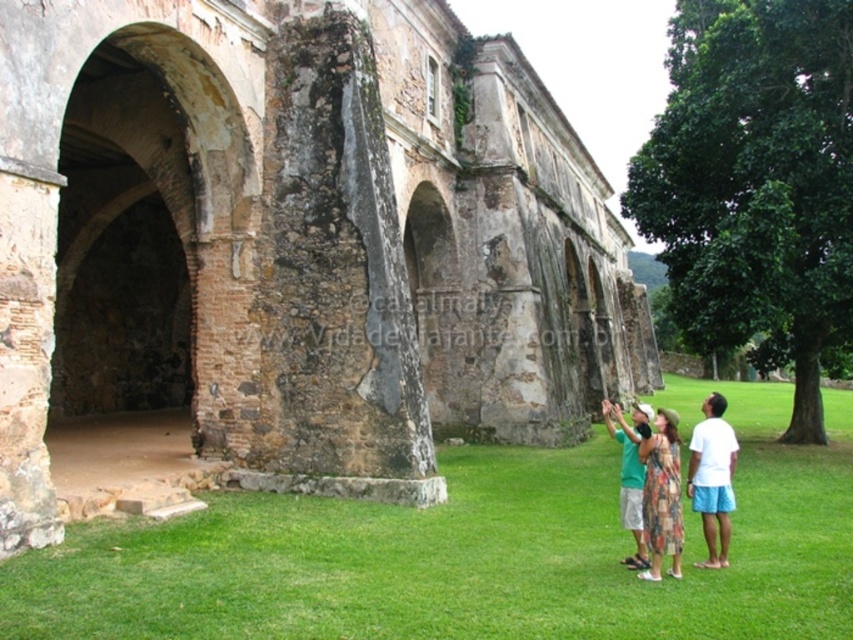
You are a tourist standing in front of the historical stone structure. You notice the weathered stone arches at center and the white cotton shirt at lower right. Which object is closer to you?

The weathered stone arches at center is closer to you because it is in front of the white cotton shirt at lower right.

You are standing at the entrance of the historical stone structure and want to walk to the green grass at lower center. Which direction should you move relative to the weathered stone arches at center?

To reach the green grass at lower center, you should move forward past the weathered stone arches at center since the green grass at lower center is behind them.

You are standing at point [693,490] and want to walk to the historical stone structure. Is the point [169,176] between you and the structure?

Point [169,176] is behind point [693,490], so it is not between you and the historical stone structure. You can walk towards the structure without obstruction from point [169,176].